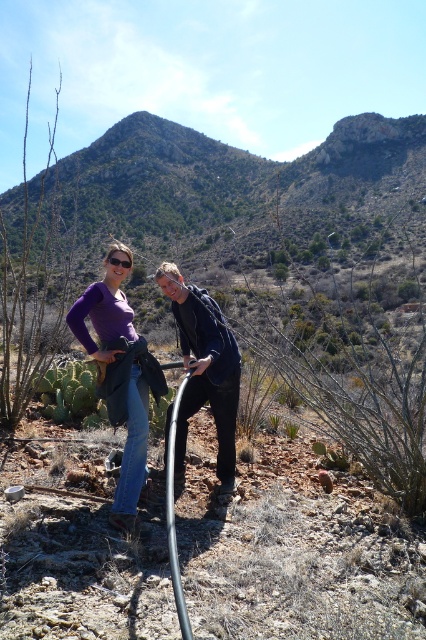
You are a photographer setting up a shot in the desert scene. You need to ensure that the black matte jacket at center and the matte purple shirt at center are both visible in the frame. Given their sizes, which one might you need to position closer to the camera to ensure it appears larger in the photo?

The black matte jacket at center is smaller in size compared to the matte purple shirt at center. To make the black matte jacket at center appear larger in the photo, you should position it closer to the camera.

You are a photographer trying to capture the black matte jacket at center in the image. The camera is set to focus on the point at coordinates (204, 369). Can you confirm if the black matte jacket at center is within the focus area of the camera?

Yes, the point at coordinates (204, 369) indicates the black matte jacket at center, so the camera is focused on it.